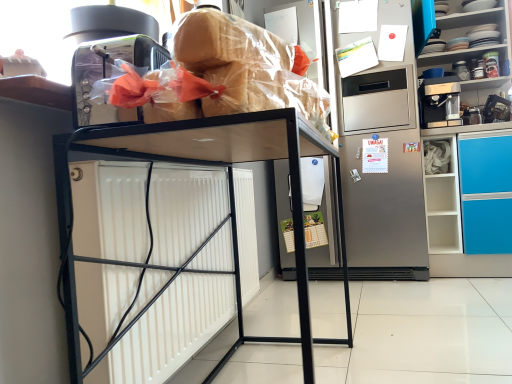
Measure the distance between translucent plastic bread at upper center and camera.

25.16 inches.

This screenshot has height=384, width=512. In order to click on black metal shelf at center in this screenshot , I will do `click(230, 207)`.

Find the location of a particular element. bread at upper center is located at coordinates (225, 42).

Does porcelain plates at upper right have a lesser width compared to bread at upper center?

No.

Does porcelain plates at upper right have a smaller size compared to bread at upper center?

No, porcelain plates at upper right is not smaller than bread at upper center.

How many degrees apart are the facing directions of porcelain plates at upper right and bread at upper center?

There is a 74-degree angle between the facing directions of porcelain plates at upper right and bread at upper center.

In the scene shown: From the image's perspective, is black metal shelf at center on stainless steel refrigerator at center?

Actually, black metal shelf at center appears below stainless steel refrigerator at center in the image.

Can you confirm if black metal shelf at center is positioned to the left of stainless steel refrigerator at center?

Correct, you'll find black metal shelf at center to the left of stainless steel refrigerator at center.

Does black metal shelf at center have a larger size compared to stainless steel refrigerator at center?

No.

How many degrees apart are the facing directions of black metal shelf at center and stainless steel refrigerator at center?

The angle between the facing direction of black metal shelf at center and the facing direction of stainless steel refrigerator at center is 91.6 degrees.

From a real-world perspective, which is physically above, bread at upper center or stainless steel refrigerator at center?

stainless steel refrigerator at center is physically above.

Could you tell me if bread at upper center is facing stainless steel refrigerator at center?

No.

From the image's perspective, does bread at upper center appear higher than stainless steel refrigerator at center?

No.

Is bread at upper center not close to stainless steel refrigerator at center?

Yes.

Is porcelain plates at upper right at the back of black metal shelf at center?

No, black metal shelf at center is not facing the opposite direction of porcelain plates at upper right.

Looking at this image, considering the positions of objects black metal shelf at center and porcelain plates at upper right in the image provided, who is more to the left, black metal shelf at center or porcelain plates at upper right?

black metal shelf at center.

This screenshot has width=512, height=384. What are the coordinates of `furniture in front of the porcelain plates at upper right` in the screenshot? It's located at (230, 207).

Who is bigger, black metal shelf at center or porcelain plates at upper right?

Bigger between the two is porcelain plates at upper right.

Is bread at upper center facing away from porcelain plates at upper right?

No, bread at upper center is not facing away from porcelain plates at upper right.

Can you tell me how much bread at upper center and porcelain plates at upper right differ in facing direction?

The facing directions of bread at upper center and porcelain plates at upper right are 74 degrees apart.

Are bread at upper center and porcelain plates at upper right located far from each other?

Yes, bread at upper center and porcelain plates at upper right are quite far apart.

Is translucent plastic bread at upper center situated inside bread at upper center or outside?

translucent plastic bread at upper center is located beyond the bounds of bread at upper center.

From a real-world perspective, which is physically below, translucent plastic bread at upper center or bread at upper center?

From a 3D spatial view, bread at upper center is below.

Is translucent plastic bread at upper center further to camera compared to bread at upper center?

Yes, the depth of translucent plastic bread at upper center is greater than that of bread at upper center.

From the image's perspective, is translucent plastic bread at upper center located above bread at upper center?

Correct, translucent plastic bread at upper center appears higher than bread at upper center in the image.

Looking at this image, considering the relative sizes of stainless steel refrigerator at center and translucent plastic bread at upper center in the image provided, is stainless steel refrigerator at center wider than translucent plastic bread at upper center?

Yes, stainless steel refrigerator at center is wider than translucent plastic bread at upper center.

Looking at the image, does stainless steel refrigerator at center seem bigger or smaller compared to translucent plastic bread at upper center?

Considering their sizes, stainless steel refrigerator at center takes up more space than translucent plastic bread at upper center.

Considering the positions of points (362, 225) and (279, 98), is point (362, 225) closer to camera compared to point (279, 98)?

That is False.

Locate an element on the screen. The height and width of the screenshot is (384, 512). shelf on the right of bread at upper center is located at coordinates (472, 49).

I want to click on appliance above the black metal shelf at center (from a real-world perspective), so [x=387, y=151].

Which object lies further to the anchor point translucent plastic bread at upper center, black metal shelf at center or porcelain plates at upper right?

porcelain plates at upper right is positioned further to the anchor translucent plastic bread at upper center.

Which object lies further to the anchor point stainless steel refrigerator at center, black metal shelf at center or porcelain plates at upper right?

black metal shelf at center.

Considering their positions, is porcelain plates at upper right positioned closer to stainless steel refrigerator at center than black metal shelf at center?

porcelain plates at upper right is closer to stainless steel refrigerator at center.

From the picture: Based on their spatial positions, is black metal shelf at center or bread at upper center closer to stainless steel refrigerator at center?

Based on the image, black metal shelf at center appears to be nearer to stainless steel refrigerator at center.

From the image, which object appears to be farther from stainless steel refrigerator at center, translucent plastic bread at upper center or black metal shelf at center?

translucent plastic bread at upper center lies further to stainless steel refrigerator at center than the other object.

Based on their spatial positions, is bread at upper center or porcelain plates at upper right further from black metal shelf at center?

porcelain plates at upper right is further to black metal shelf at center.

Considering their positions, is translucent plastic bread at upper center positioned further to porcelain plates at upper right than bread at upper center?

translucent plastic bread at upper center lies further to porcelain plates at upper right than the other object.

Which object lies further to the anchor point stainless steel refrigerator at center, bread at upper center or porcelain plates at upper right?

Among the two, bread at upper center is located further to stainless steel refrigerator at center.

Find the location of a particular element. Image resolution: width=512 pixels, height=384 pixels. bread positioned between black metal shelf at center and porcelain plates at upper right from near to far is located at coordinates (225, 42).

Where is `shelf positioned between bread at upper center and stainless steel refrigerator at center from near to far`? This screenshot has width=512, height=384. shelf positioned between bread at upper center and stainless steel refrigerator at center from near to far is located at coordinates (472, 49).

I want to click on bread between translucent plastic bread at upper center and black metal shelf at center vertically, so click(x=225, y=42).

Locate an element on the screen. shelf located between black metal shelf at center and stainless steel refrigerator at center in the depth direction is located at coordinates (472, 49).